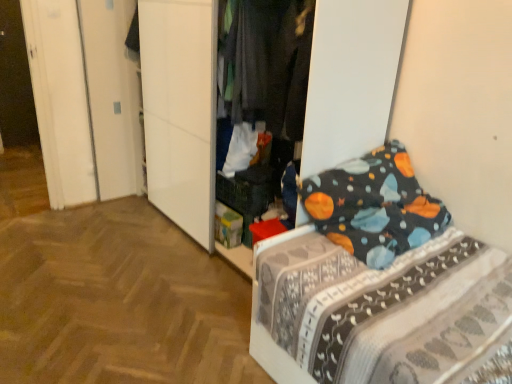
Question: Is dark gray fabric pants at center in front of or behind dark blue fabric bed at right in the image?

Choices:
 (A) behind
 (B) front

Answer: (A)

Question: From the image's perspective, is dark gray fabric pants at center positioned above or below dark blue fabric bed at right?

Choices:
 (A) below
 (B) above

Answer: (B)

Question: Is dark gray fabric pants at center to the left or to the right of dark blue fabric bed at right in the image?

Choices:
 (A) right
 (B) left

Answer: (B)

Question: Considering the positions of dark blue fabric bed at right and dark gray fabric pants at center in the image, is dark blue fabric bed at right bigger or smaller than dark gray fabric pants at center?

Choices:
 (A) small
 (B) big

Answer: (B)

Question: From a real-world perspective, is dark blue fabric bed at right physically located above or below dark gray fabric pants at center?

Choices:
 (A) below
 (B) above

Answer: (A)

Question: In the image, is dark blue fabric bed at right positioned in front of or behind dark gray fabric pants at center?

Choices:
 (A) front
 (B) behind

Answer: (A)

Question: Is dark blue fabric bed at right taller or shorter than dark gray fabric pants at center?

Choices:
 (A) tall
 (B) short

Answer: (B)